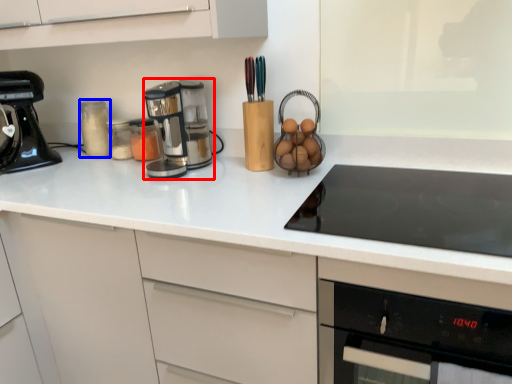
Question: Which of the following is the farthest to the observer, kitchen appliance (highlighted by a red box) or bottle (highlighted by a blue box)?

Choices:
 (A) kitchen appliance
 (B) bottle

Answer: (B)